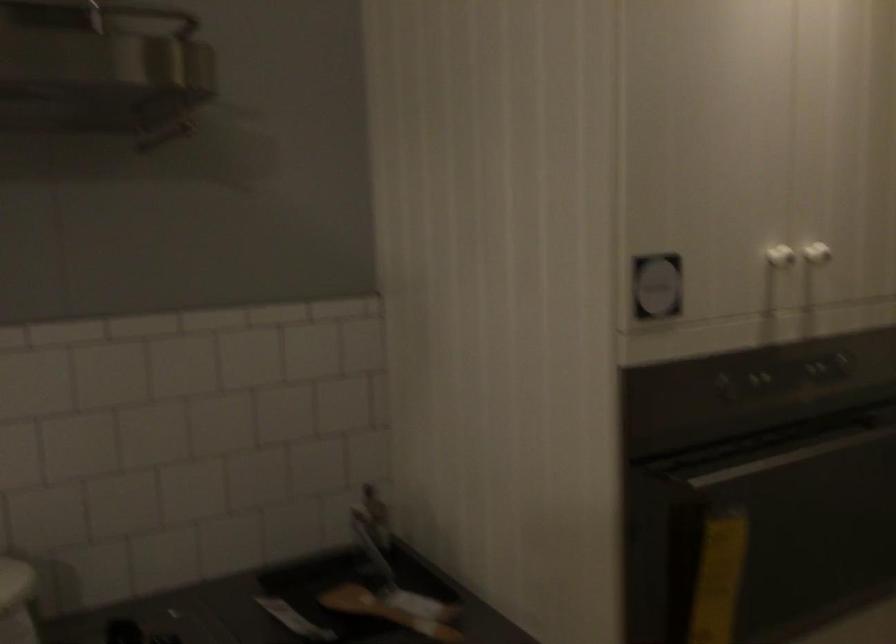
Question: The camera is either moving clockwise (left) or counter-clockwise (right) around the object. The first image is from the beginning of the video and the second image is from the end. Is the camera moving left or right when shooting the video?

Choices:
 (A) Left
 (B) Right

Answer: (A)